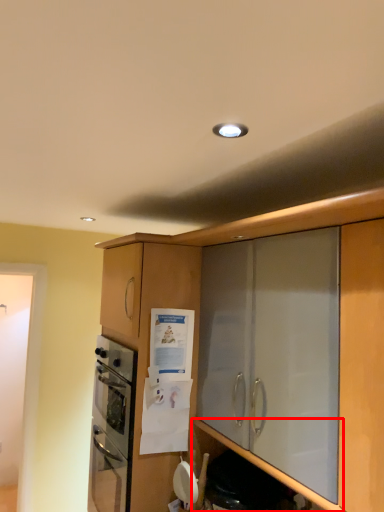
Question: In this image, where is shelf (annotated by the red box) located relative to cabinetry?

Choices:
 (A) left
 (B) right

Answer: (B)